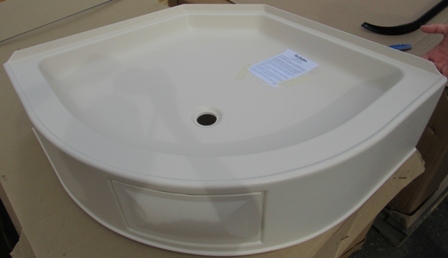
You are a GUI agent. You are given a task and a screenshot of the screen. Output one action in this format:
    pyautogui.click(x=<x>, y=<y>)
    Task: Click on the cardboard box
    
    Given the screenshot: What is the action you would take?
    pyautogui.click(x=359, y=225)